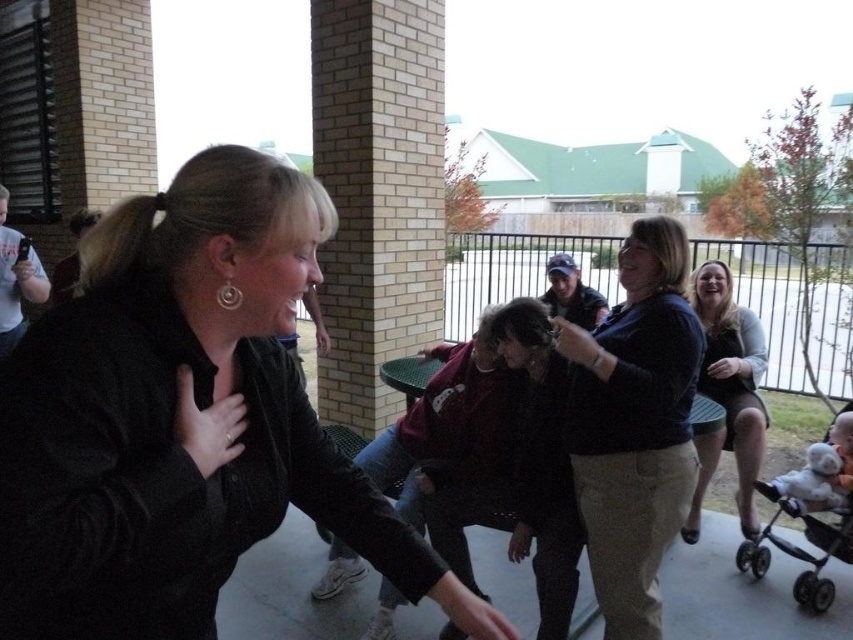
Between dark blue sweater at center and matte black dress at right, which one is positioned lower?

Positioned lower is dark blue sweater at center.

Is point (677, 280) positioned before point (711, 433)?

Yes, it is in front of point (711, 433).

What do you see at coordinates (634, 424) in the screenshot?
I see `dark blue sweater at center` at bounding box center [634, 424].

Find the location of a particular element. Image resolution: width=853 pixels, height=640 pixels. dark blue sweater at center is located at coordinates (634, 424).

Which is in front, point (202, 570) or point (838, 492)?

Point (202, 570) is in front.

Does black matte jacket at left have a larger size compared to white plush toy at lower right?

Yes.

At what (x,y) coordinates should I click in order to perform the action: click on black matte jacket at left. Please return your answer as a coordinate pair (x, y). The image size is (853, 640). Looking at the image, I should click on (181, 419).

Between dark blue sweater at center and white plush toy at lower right, which one has more height?

dark blue sweater at center

From the picture: Between dark blue sweater at center and white plush toy at lower right, which one has less height?

white plush toy at lower right

Is point (695, 468) positioned in front of point (822, 500)?

Yes, point (695, 468) is in front of point (822, 500).

At what (x,y) coordinates should I click in order to perform the action: click on dark blue sweater at center. Please return your answer as a coordinate pair (x, y). The image size is (853, 640). Looking at the image, I should click on (634, 424).